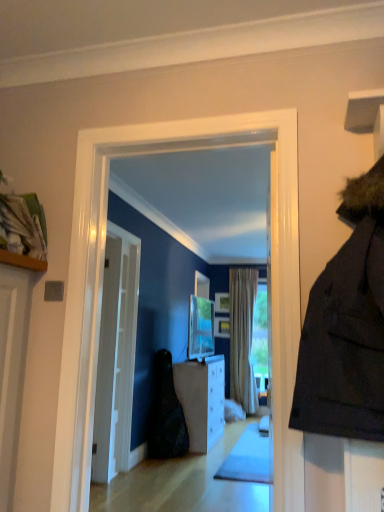
Image resolution: width=384 pixels, height=512 pixels. What do you see at coordinates (222, 327) in the screenshot?
I see `wooden picture frame at center, placed as the second picture frame when sorted from top to bottom` at bounding box center [222, 327].

Where is `white glossy door at center`? white glossy door at center is located at coordinates (116, 355).

Identify the location of matte silver tv at center. (200, 328).

Image resolution: width=384 pixels, height=512 pixels. In order to click on wooden picture frame at center, the 1th picture frame in the top-to-bottom sequence in this screenshot , I will do [222, 303].

Describe the element at coordinates (166, 414) in the screenshot. I see `black fabric bag at center` at that location.

In order to face black fabric bag at center, should I rotate leftwards or rightwards?

Turn left by 2.844 degrees to look at black fabric bag at center.

What do you see at coordinates (201, 400) in the screenshot? The image size is (384, 512). I see `white glossy cabinet at center` at bounding box center [201, 400].

What is the approximate width of white glossy cabinet at center?

It is 18.88 inches.

What do you see at coordinates (242, 336) in the screenshot?
I see `beige fabric curtain at center` at bounding box center [242, 336].

The image size is (384, 512). Find the location of `wooden picture frame at center, placed as the second picture frame when sorted from top to bottom`. wooden picture frame at center, placed as the second picture frame when sorted from top to bottom is located at coordinates (222, 327).

Which is more to the left, white glossy cabinet at center or black fabric bag at center?

black fabric bag at center is more to the left.

This screenshot has height=512, width=384. Identify the location of cabinetry behind the black fabric bag at center. (201, 400).

Which is correct: white glossy cabinet at center is inside black fabric bag at center, or outside of it?

white glossy cabinet at center is not enclosed by black fabric bag at center.

Considering the relative sizes of wooden picture frame at center, placed as the second picture frame when sorted from top to bottom, and beige fabric curtain at center in the image provided, is wooden picture frame at center, placed as the second picture frame when sorted from top to bottom, shorter than beige fabric curtain at center?

Correct, wooden picture frame at center, placed as the second picture frame when sorted from top to bottom, is not as tall as beige fabric curtain at center.

Identify the location of picture frame that is the 1st one when counting upward from the beige fabric curtain at center (from the image's perspective). This screenshot has height=512, width=384. (x=222, y=327).

From a real-world perspective, who is located higher, wooden picture frame at center, placed as the first picture frame when sorted from bottom to top, or beige fabric curtain at center?

wooden picture frame at center, placed as the first picture frame when sorted from bottom to top, is physically above.

Which is more to the left, beige fabric curtain at center or black fabric bag at center?

Positioned to the left is black fabric bag at center.

What's the angular difference between beige fabric curtain at center and black fabric bag at center's facing directions?

The angle between the facing direction of beige fabric curtain at center and the facing direction of black fabric bag at center is 88.4 degrees.

From the image's perspective, between beige fabric curtain at center and black fabric bag at center, which one is located above?

beige fabric curtain at center, from the image's perspective.

The image size is (384, 512). Identify the location of curtain above the black fabric bag at center (from the image's perspective). (242, 336).

Are black fabric bag at center and white glossy cabinet at center making contact?

No, black fabric bag at center is not beside white glossy cabinet at center.

From a real-world perspective, is black fabric bag at center under white glossy cabinet at center?

No, from a real-world perspective, black fabric bag at center is not under white glossy cabinet at center.

Consider the image. Based on their positions, is black fabric bag at center located to the left or right of white glossy cabinet at center?

black fabric bag at center is to the left of white glossy cabinet at center.

Is black fabric bag at center positioned with its back to white glossy cabinet at center?

black fabric bag at center is not turned away from white glossy cabinet at center.

Image resolution: width=384 pixels, height=512 pixels. In order to click on curtain below the matte silver tv at center (from the image's perspective) in this screenshot , I will do `click(242, 336)`.

Considering the positions of points (195, 308) and (245, 391), is point (195, 308) closer to camera compared to point (245, 391)?

Yes, point (195, 308) is in front of point (245, 391).

Are matte silver tv at center and beige fabric curtain at center making contact?

matte silver tv at center and beige fabric curtain at center are not in contact.

Do you think matte silver tv at center is within beige fabric curtain at center, or outside of it?

matte silver tv at center cannot be found inside beige fabric curtain at center.

Based on the photo, is white glossy cabinet at center to the left of white glossy door at center from the viewer's perspective?

Incorrect, white glossy cabinet at center is not on the left side of white glossy door at center.

Does white glossy cabinet at center lie in front of white glossy door at center?

No.

This screenshot has width=384, height=512. Find the location of `cabinetry that appears on the right of white glossy door at center`. cabinetry that appears on the right of white glossy door at center is located at coordinates (201, 400).

In the image, there is a white glossy door at center. Where is `picture frame below it (from the image's perspective)`? This screenshot has width=384, height=512. picture frame below it (from the image's perspective) is located at coordinates (222, 327).

Considering the relative sizes of white glossy door at center and wooden picture frame at center, placed as the second picture frame when sorted from top to bottom, in the image provided, is white glossy door at center shorter than wooden picture frame at center, placed as the second picture frame when sorted from top to bottom,?

In fact, white glossy door at center may be taller than wooden picture frame at center, placed as the second picture frame when sorted from top to bottom.

From the image's perspective, is white glossy door at center located beneath wooden picture frame at center, placed as the second picture frame when sorted from top to bottom?

No.

Which is in front, white glossy door at center or wooden picture frame at center, placed as the first picture frame when sorted from bottom to top?

white glossy door at center is more forward.

Locate an element on the screen. cabinetry that appears below the black fabric bag at center (from the image's perspective) is located at coordinates (201, 400).

What are the coordinates of `the 1st picture frame above the beige fabric curtain at center (from a real-world perspective)` in the screenshot? It's located at (222, 327).

Which object lies further to the anchor point white glossy cabinet at center, beige fabric curtain at center or wooden picture frame at center, the second picture frame in the bottom-to-top sequence?

The object further to white glossy cabinet at center is wooden picture frame at center, the second picture frame in the bottom-to-top sequence.

Looking at the image, which one is located closer to white glossy cabinet at center, wooden picture frame at center, the 1th picture frame in the top-to-bottom sequence, or white glossy door at center?

white glossy door at center is positioned closer to the anchor white glossy cabinet at center.

When comparing their distances from matte silver tv at center, does wooden picture frame at center, the 1th picture frame in the top-to-bottom sequence, or beige fabric curtain at center seem closer?

The object closer to matte silver tv at center is wooden picture frame at center, the 1th picture frame in the top-to-bottom sequence.

Looking at the image, which one is located closer to matte silver tv at center, beige fabric curtain at center or wooden picture frame at center, the 1th picture frame in the top-to-bottom sequence?

wooden picture frame at center, the 1th picture frame in the top-to-bottom sequence, is closer to matte silver tv at center.

From the picture: Looking at the image, which one is located closer to wooden picture frame at center, placed as the first picture frame when sorted from bottom to top, white glossy door at center or black fabric bag at center?

black fabric bag at center.

Estimate the real-world distances between objects in this image. Which object is closer to white glossy door at center, white glossy cabinet at center or wooden picture frame at center, placed as the first picture frame when sorted from bottom to top?

The object closer to white glossy door at center is white glossy cabinet at center.

Consider the image. Estimate the real-world distances between objects in this image. Which object is further from black fabric bag at center, wooden picture frame at center, placed as the first picture frame when sorted from bottom to top, or beige fabric curtain at center?

wooden picture frame at center, placed as the first picture frame when sorted from bottom to top, is positioned further to the anchor black fabric bag at center.

Estimate the real-world distances between objects in this image. Which object is closer to black fabric bag at center, beige fabric curtain at center or matte silver tv at center?

matte silver tv at center is closer to black fabric bag at center.

This screenshot has width=384, height=512. Identify the location of dark between matte silver tv at center and white glossy cabinet at center vertically. (166, 414).

Where is `cabinetry between white glossy door at center and wooden picture frame at center, placed as the second picture frame when sorted from top to bottom, in the front-back direction`? cabinetry between white glossy door at center and wooden picture frame at center, placed as the second picture frame when sorted from top to bottom, in the front-back direction is located at coordinates (201, 400).

Image resolution: width=384 pixels, height=512 pixels. In order to click on curtain positioned between white glossy door at center and wooden picture frame at center, the second picture frame in the bottom-to-top sequence, from near to far in this screenshot , I will do `click(242, 336)`.

Where is `cabinetry located between black fabric bag at center and beige fabric curtain at center in the depth direction`? cabinetry located between black fabric bag at center and beige fabric curtain at center in the depth direction is located at coordinates (201, 400).